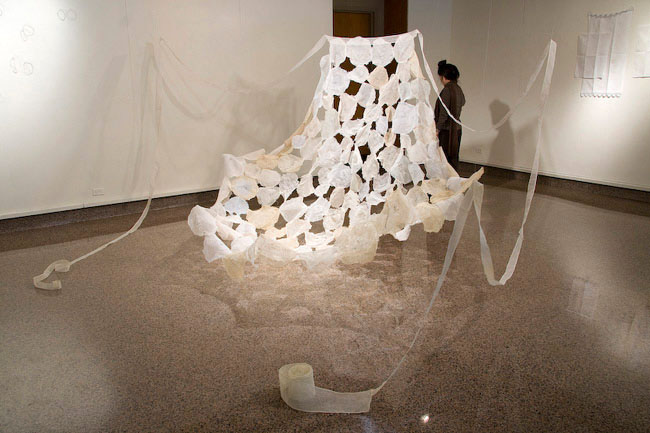
This screenshot has height=433, width=650. In order to click on tissue in this screenshot , I will do `click(377, 195)`.